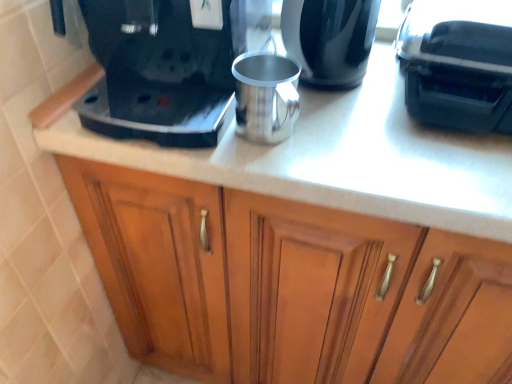
Question: Is wooden cabinet at center in contact with black plastic coffee machine at upper right?

Choices:
 (A) yes
 (B) no

Answer: (B)

Question: Can you confirm if wooden cabinet at center is positioned to the right of black plastic coffee machine at upper right?

Choices:
 (A) no
 (B) yes

Answer: (A)

Question: Would you say black plastic coffee machine at upper right is part of wooden cabinet at center's contents?

Choices:
 (A) no
 (B) yes

Answer: (A)

Question: Considering the relative sizes of wooden cabinet at center and black plastic coffee machine at upper right in the image provided, is wooden cabinet at center shorter than black plastic coffee machine at upper right?

Choices:
 (A) yes
 (B) no

Answer: (B)

Question: From a real-world perspective, is wooden cabinet at center located higher than black plastic coffee machine at upper right?

Choices:
 (A) yes
 (B) no

Answer: (B)

Question: Is wooden cabinet at center bigger than black plastic coffee machine at upper right?

Choices:
 (A) yes
 (B) no

Answer: (A)

Question: Is shiny black kettle at upper center positioned behind black plastic coffee machine at upper right?

Choices:
 (A) yes
 (B) no

Answer: (A)

Question: Does shiny black kettle at upper center have a larger size compared to black plastic coffee machine at upper right?

Choices:
 (A) yes
 (B) no

Answer: (B)

Question: From the image's perspective, is shiny black kettle at upper center located beneath black plastic coffee machine at upper right?

Choices:
 (A) yes
 (B) no

Answer: (B)

Question: Does shiny black kettle at upper center appear on the left side of black plastic coffee machine at upper right?

Choices:
 (A) yes
 (B) no

Answer: (A)

Question: Is shiny black kettle at upper center positioned with its back to black plastic coffee machine at upper right?

Choices:
 (A) no
 (B) yes

Answer: (A)

Question: Can you confirm if shiny black kettle at upper center is positioned to the right of black plastic coffee machine at upper right?

Choices:
 (A) yes
 (B) no

Answer: (B)

Question: Does shiny black kettle at upper center have a lesser width compared to black plastic coffee maker at upper left?

Choices:
 (A) no
 (B) yes

Answer: (B)